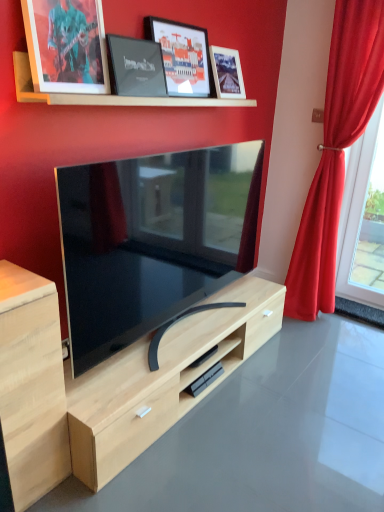
Question: Should I look upward or downward to see wooden at upper center?

Choices:
 (A) up
 (B) down

Answer: (A)

Question: Should I look upward or downward to see red velvet curtain at right?

Choices:
 (A) down
 (B) up

Answer: (B)

Question: Does matte black tv at center have a smaller size compared to matte black picture frame at upper center, positioned as the third picture frame in right-to-left order?

Choices:
 (A) no
 (B) yes

Answer: (A)

Question: Is matte black tv at center placed right next to matte black picture frame at upper center, positioned as the third picture frame in right-to-left order?

Choices:
 (A) yes
 (B) no

Answer: (B)

Question: From the image's perspective, is matte black tv at center beneath matte black picture frame at upper center, arranged as the 2th picture frame when viewed from the left?

Choices:
 (A) no
 (B) yes

Answer: (B)

Question: Is matte black tv at center taller than matte black picture frame at upper center, positioned as the third picture frame in right-to-left order?

Choices:
 (A) yes
 (B) no

Answer: (A)

Question: Would you consider matte black tv at center to be distant from matte black picture frame at upper center, positioned as the third picture frame in right-to-left order?

Choices:
 (A) no
 (B) yes

Answer: (A)

Question: Is matte black tv at center thinner than matte black picture frame at upper center, arranged as the 2th picture frame when viewed from the left?

Choices:
 (A) yes
 (B) no

Answer: (B)

Question: Is the position of matte glass picture frame at upper center, which is the fourth picture frame in left-to-right order, less distant than that of light wood cabinet at left?

Choices:
 (A) no
 (B) yes

Answer: (A)

Question: Can you confirm if matte glass picture frame at upper center, the first picture frame from the right, is smaller than light wood cabinet at left?

Choices:
 (A) yes
 (B) no

Answer: (A)

Question: From the image's perspective, is matte glass picture frame at upper center, the first picture frame from the right, on light wood cabinet at left?

Choices:
 (A) yes
 (B) no

Answer: (A)

Question: Would you say matte glass picture frame at upper center, which is the fourth picture frame in left-to-right order, contains light wood cabinet at left?

Choices:
 (A) yes
 (B) no

Answer: (B)

Question: From the image's perspective, is matte glass picture frame at upper center, which is the fourth picture frame in left-to-right order, beneath light wood cabinet at left?

Choices:
 (A) no
 (B) yes

Answer: (A)

Question: Can you confirm if matte glass picture frame at upper center, which is the fourth picture frame in left-to-right order, is positioned to the right of light wood cabinet at left?

Choices:
 (A) yes
 (B) no

Answer: (A)

Question: Is red velvet curtain at right positioned with its back to matte glass picture frame at upper center, which is the fourth picture frame in left-to-right order?

Choices:
 (A) no
 (B) yes

Answer: (A)